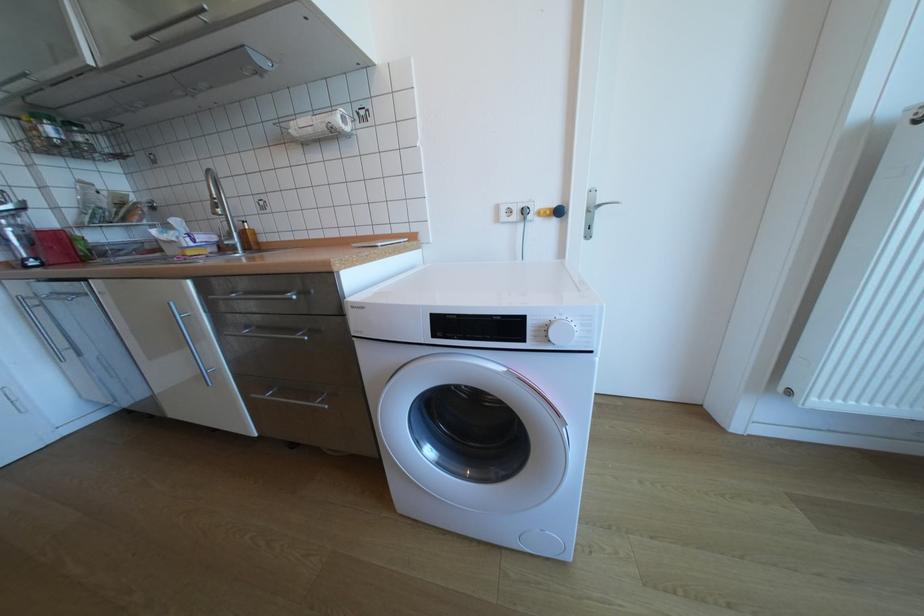
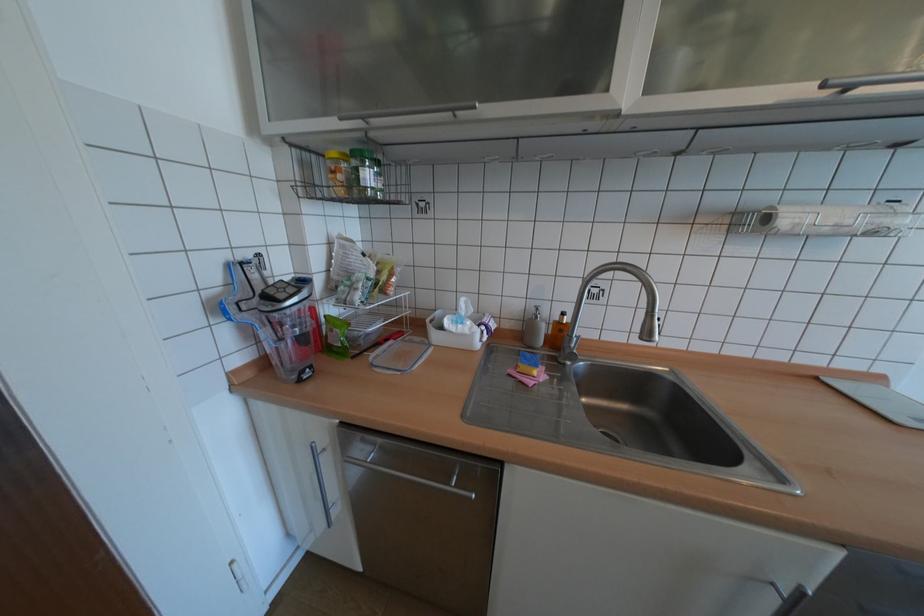
Where in the second image is the point corresponding to (x=334, y=124) from the first image?

(881, 227)